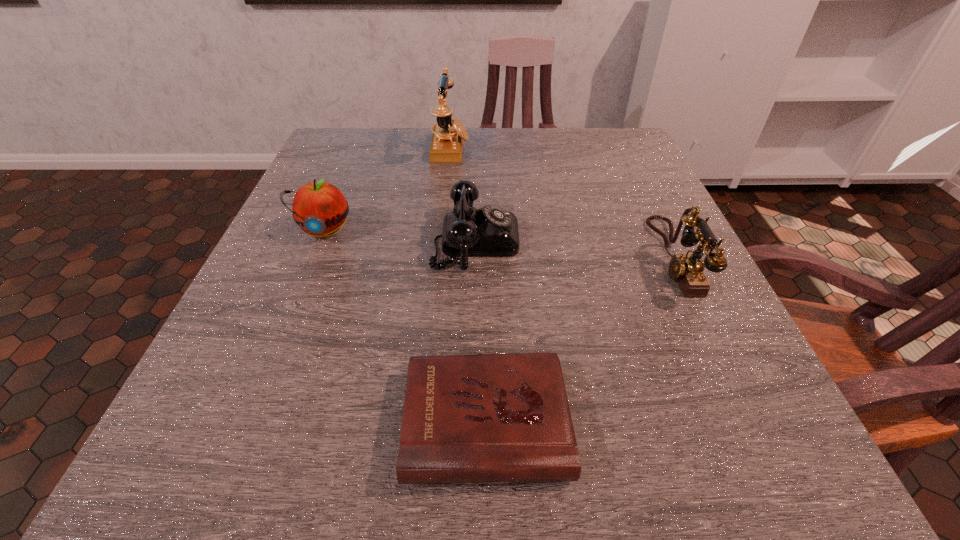
Identify the location of free space between the leftmost object and the shortest telephone. The height and width of the screenshot is (540, 960). (399, 235).

This screenshot has width=960, height=540. Identify the location of free area in between the shortest object and the second shortest object. (481, 331).

You are a GUI agent. You are given a task and a screenshot of the screen. Output one action in this format:
    pyautogui.click(x=<x>, y=<y>)
    Task: Click on the free spot between the second shortest object and the apple
    The height and width of the screenshot is (540, 960).
    Given the screenshot: What is the action you would take?
    click(x=399, y=235)

Find the location of a particular element. free area in between the hardback book and the fourth tallest object is located at coordinates (481, 331).

Locate an element on the screen. free spot between the second shortest telephone and the farthest telephone is located at coordinates (562, 204).

Find the location of a particular element. The height and width of the screenshot is (540, 960). the third closest object to the second tallest telephone is located at coordinates (448, 134).

What are the coordinates of `the closest object to the nearest object` in the screenshot? It's located at (490, 231).

Choose which telephone is the second nearest neighbor to the apple. Please provide its 2D coordinates. Your answer should be formatted as a tuple, i.e. [(x, y)], where the tuple contains the x and y coordinates of a point satisfying the conditions above.

[(448, 134)]

Find the location of a particular element. The width and height of the screenshot is (960, 540). telephone that is the closest to the apple is located at coordinates (490, 231).

Identify the location of blank space that satisfies the following two spatial constraints: 1. on the front side of the hardback book; 2. on the left side of the leftmost object. This screenshot has height=540, width=960. (245, 422).